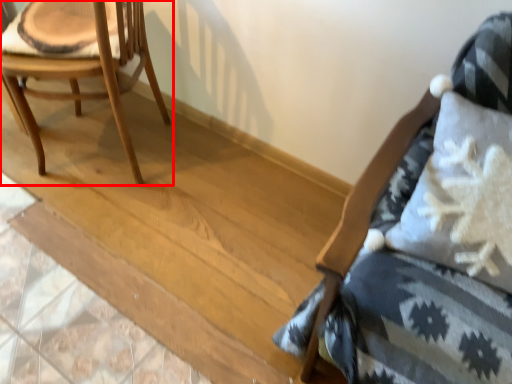
Question: In this image, where is chair (annotated by the red box) located relative to chair?

Choices:
 (A) left
 (B) right

Answer: (A)